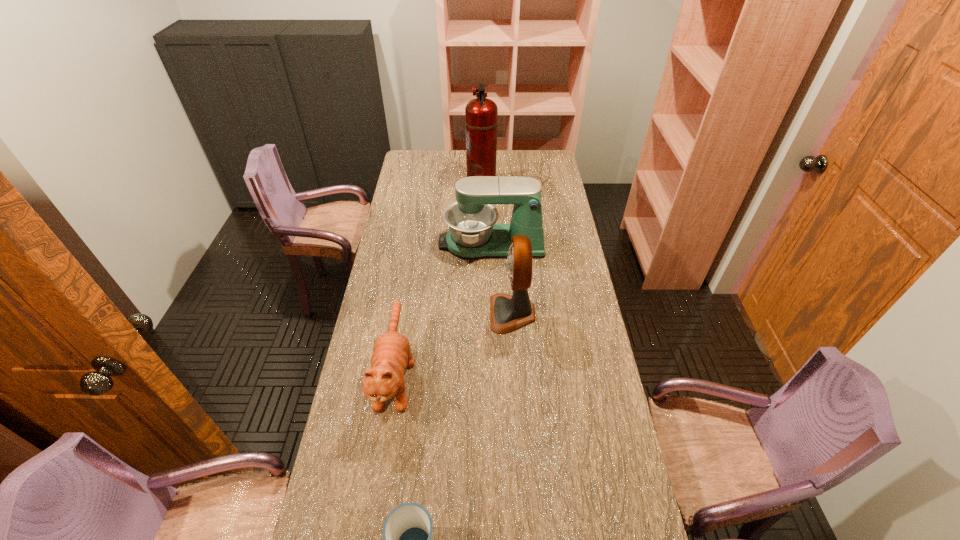
I want to click on free space located on the front-facing side of the fan, so click(x=388, y=313).

Find the location of `free space located 0.230m on the front-facing side of the fan`. free space located 0.230m on the front-facing side of the fan is located at coordinates (426, 313).

Find the location of a particular element. The width and height of the screenshot is (960, 540). vacant space located on the front-facing side of the fourth nearest object is located at coordinates (408, 243).

You are a GUI agent. You are given a task and a screenshot of the screen. Output one action in this format:
    pyautogui.click(x=<x>, y=<y>)
    Task: Click on the vacant space located on the front-facing side of the fourth nearest object
    
    Given the screenshot: What is the action you would take?
    [x=400, y=243]

The width and height of the screenshot is (960, 540). I want to click on free point located on the front-facing side of the fourth nearest object, so click(x=387, y=243).

You are a GUI agent. You are given a task and a screenshot of the screen. Output one action in this format:
    pyautogui.click(x=<x>, y=<y>)
    Task: Click on the blank space located on the face of the second shortest object
    The height and width of the screenshot is (540, 960).
    Given the screenshot: What is the action you would take?
    pyautogui.click(x=384, y=449)

This screenshot has height=540, width=960. What are the coordinates of `object situated at the far edge` in the screenshot? It's located at (481, 114).

The height and width of the screenshot is (540, 960). Identify the location of object located at the left edge. (391, 356).

You are a GUI agent. You are given a task and a screenshot of the screen. Output one action in this format:
    pyautogui.click(x=<x>, y=<y>)
    Task: Click on the object that is at the right edge
    Image resolution: width=960 pixels, height=540 pixels.
    Given the screenshot: What is the action you would take?
    pyautogui.click(x=473, y=234)

Where is `free region at the far edge`? free region at the far edge is located at coordinates (516, 150).